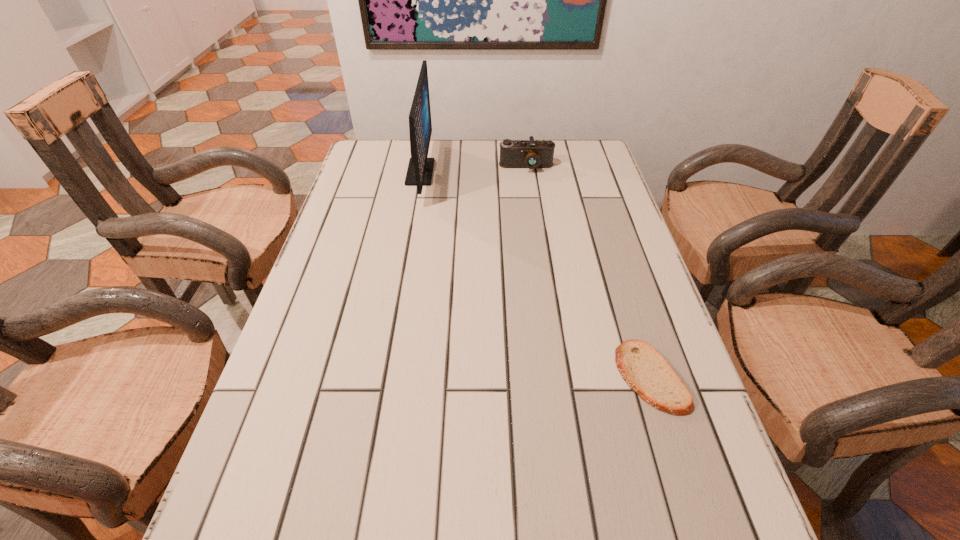
Locate an element on the screen. This screenshot has width=960, height=540. empty location between the shortest object and the leftmost object is located at coordinates (535, 275).

The image size is (960, 540). I want to click on empty space between the camera and the computer monitor, so click(x=473, y=170).

Identify the location of vacant point located between the nearest object and the leftmost object. The image size is (960, 540). (535, 275).

The height and width of the screenshot is (540, 960). I want to click on free space between the second tallest object and the leftmost object, so click(x=473, y=170).

This screenshot has height=540, width=960. In order to click on vacant space in between the tallest object and the nearest object in this screenshot , I will do `click(535, 275)`.

In order to click on free space between the rightmost object and the camera in this screenshot , I will do `click(588, 272)`.

Identify the location of vacant area that lies between the tallest object and the second object from left to right. The height and width of the screenshot is (540, 960). (473, 170).

I want to click on object that is the closest to the second tallest object, so click(420, 168).

Locate an element on the screen. The image size is (960, 540). the closest object to the leftmost object is located at coordinates (531, 154).

Locate an element on the screen. The image size is (960, 540). vacant space that satisfies the following two spatial constraints: 1. on the lens of the second object from left to right; 2. on the screen side of the computer monitor is located at coordinates point(527,172).